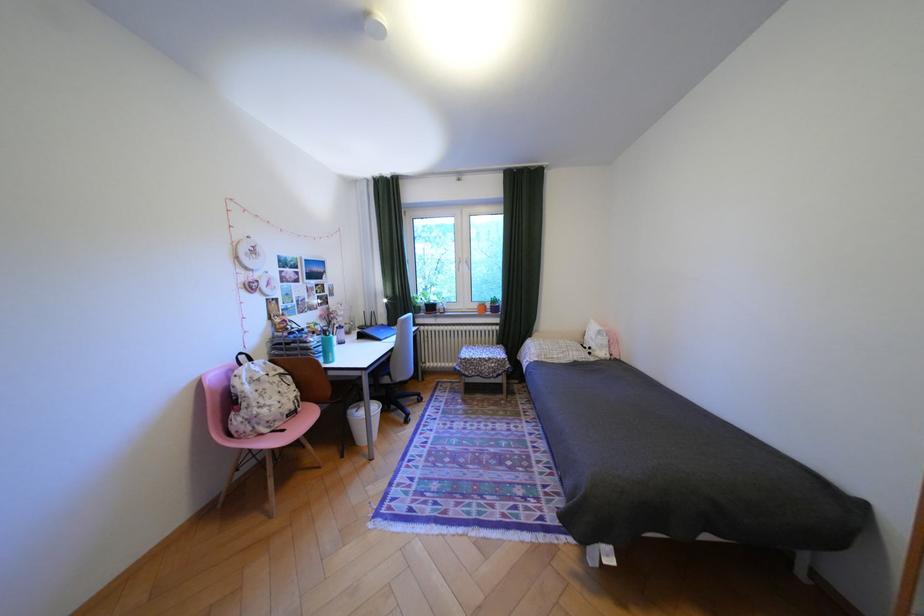
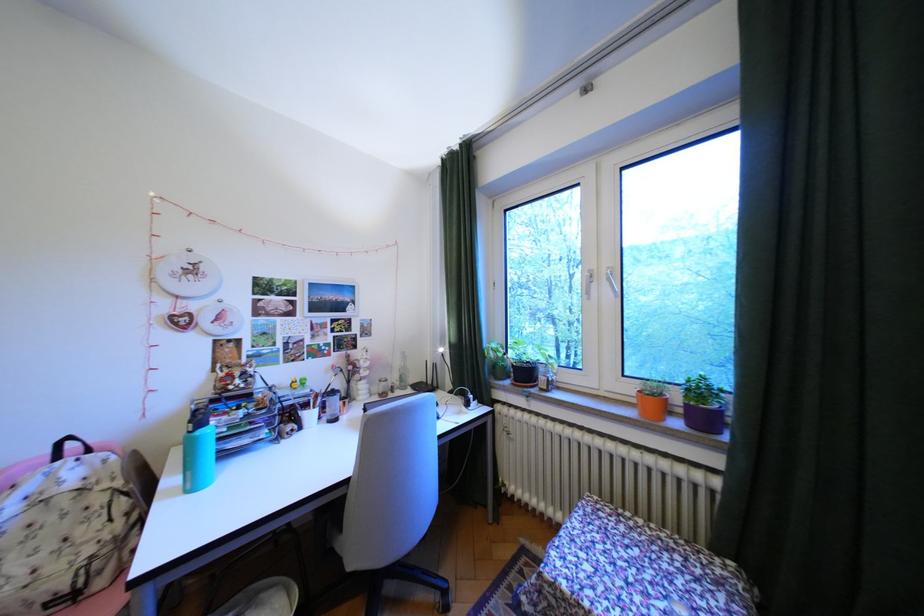
Find the pixel in the second image that matches (x=505, y=301) in the first image.

(710, 391)